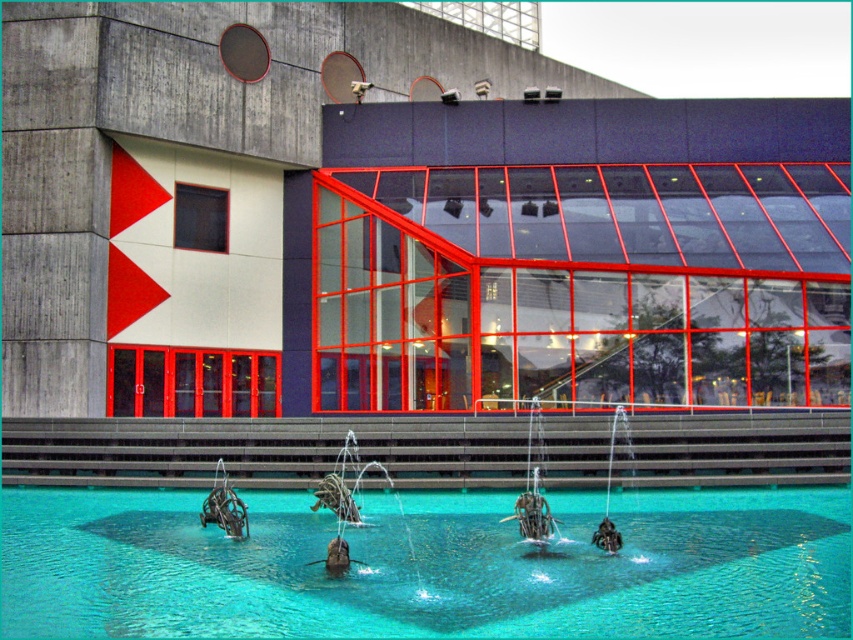
Looking at this image, you are standing at the entrance of the building and notice two points marked on the ground. The first point is labeled as point [1,545] and the second is point [233,509]. From your current position, which point is closer to you?

Point [1,545] is in front of point [233,509], so it is closer to you.

You are a visitor at the building and want to take a photo of both the clear glass swimming pool at center and the metallic sculpture at lower center. Which object should you focus on first if you want to include both in your frame without zooming in?

The clear glass swimming pool at center is larger in size than the metallic sculpture at lower center, so you should focus on the metallic sculpture at lower center first to ensure both fit in the frame.

You are standing in front of the modern building and notice two points marked on the glass wall. The first point is at coordinates point (404, 605) and the second is at point (527, 426). Which point is closer to your current position?

Point (404, 605) is closer to the camera than point (527, 426), so the first point is closer to your current position.